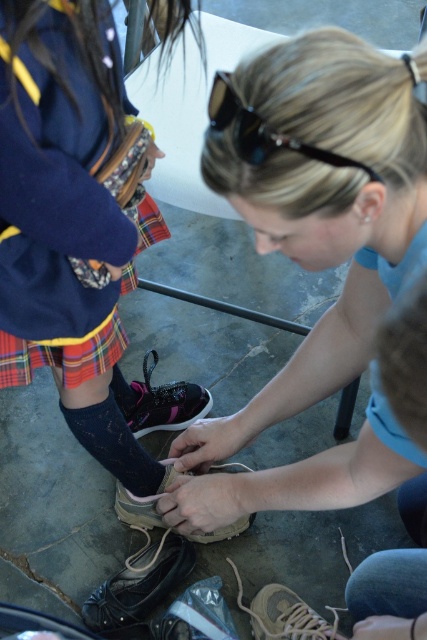
Question: Based on their relative distances, which object is farther from the matte black shoe at center?

Choices:
 (A) brown suede shoe at center
 (B) black mesh sock at lower left
 (C) pink suede sneaker at center
 (D) leather shoe at lower center

Answer: (C)

Question: Is matte black shoe at center smaller than black mesh sock at lower left?

Choices:
 (A) no
 (B) yes

Answer: (A)

Question: Which of the following is the farthest from the observer?

Choices:
 (A) black plastic sunglasses at upper center
 (B) matte black shoe at center

Answer: (A)

Question: Which point appears farthest from the camera in this image?

Choices:
 (A) (32, 376)
 (B) (116, 465)
 (C) (169, 468)
 (D) (67, 348)

Answer: (C)

Question: Does leather shoe at lower center have a lesser width compared to black mesh sock at lower left?

Choices:
 (A) no
 (B) yes

Answer: (A)

Question: Is leather shoe at lower center bigger than black plastic sunglasses at upper center?

Choices:
 (A) yes
 (B) no

Answer: (A)